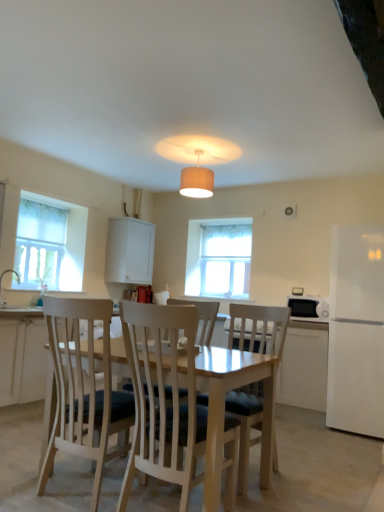
This screenshot has width=384, height=512. Describe the element at coordinates (129, 251) in the screenshot. I see `white matte cabinet at upper center` at that location.

What do you see at coordinates (50, 243) in the screenshot? This screenshot has height=512, width=384. I see `translucent fabric window at left, which appears as the 2th window when viewed from the back` at bounding box center [50, 243].

What do you see at coordinates (219, 258) in the screenshot? The image size is (384, 512). I see `white textured window at center, the 1th window from the back` at bounding box center [219, 258].

Find the location of a particular element. white glossy microwave at lower right is located at coordinates (308, 307).

Between white wood chair at center, which is the second chair from right to left, and light wood chair at center, arranged as the 2th chair when viewed from the left, which one has smaller width?

Thinner between the two is white wood chair at center, which is the second chair from right to left.

How far apart are white wood chair at center, the first chair in the left-to-right sequence, and light wood chair at center, arranged as the 2th chair when viewed from the left?

A distance of 17.47 inches exists between white wood chair at center, the first chair in the left-to-right sequence, and light wood chair at center, arranged as the 2th chair when viewed from the left.

Based on their positions, is white wood chair at center, the first chair in the left-to-right sequence, located to the left or right of light wood chair at center, arranged as the 2th chair when viewed from the left?

white wood chair at center, the first chair in the left-to-right sequence, is to the left of light wood chair at center, arranged as the 2th chair when viewed from the left.

Between white textured window at center, which is the 2th window in left-to-right order, and white glossy microwave at lower right, which one has less height?

white glossy microwave at lower right.

I want to click on window that is the 2nd object above the white glossy microwave at lower right (from a real-world perspective), so click(x=219, y=258).

Considering the points (211, 280) and (317, 297), which point is behind, point (211, 280) or point (317, 297)?

Point (211, 280)

From a real-world perspective, which is physically below, white textured window at center, the 1th window positioned from the right, or white glossy microwave at lower right?

white glossy microwave at lower right.

Would you consider light wood chair at center, arranged as the 2th chair when viewed from the left, to be distant from white glossy sink at left?

Absolutely, light wood chair at center, arranged as the 2th chair when viewed from the left, is distant from white glossy sink at left.

Is light wood chair at center, which is the first chair from right to left, situated inside white glossy sink at left or outside?

light wood chair at center, which is the first chair from right to left, exists outside the volume of white glossy sink at left.

From the image's perspective, is light wood chair at center, which is the first chair from right to left, located beneath white glossy sink at left?

Correct, light wood chair at center, which is the first chair from right to left, appears lower than white glossy sink at left in the image.

Is white glossy microwave at lower right smaller than white matte dishwasher at lower right?

Yes, white glossy microwave at lower right is smaller than white matte dishwasher at lower right.

Considering their positions, is white glossy microwave at lower right located in front of or behind white matte dishwasher at lower right?

white glossy microwave at lower right is behind white matte dishwasher at lower right.

From a real-world perspective, which object rests below the other?

white matte dishwasher at lower right.

Image resolution: width=384 pixels, height=512 pixels. Find the location of `appliance above the white matte dishwasher at lower right (from the image's perspective)`. appliance above the white matte dishwasher at lower right (from the image's perspective) is located at coordinates (308, 307).

From a real-world perspective, between white matte refrigerator at right and translucent fabric window at left, which appears as the 2th window when viewed from the back, who is vertically lower?

white matte refrigerator at right is physically lower.

From the picture: In terms of height, does white matte refrigerator at right look taller or shorter compared to translucent fabric window at left, which appears as the 2th window when viewed from the back?

white matte refrigerator at right is taller than translucent fabric window at left, which appears as the 2th window when viewed from the back.

From the picture: From the image's perspective, which is above, white matte refrigerator at right or translucent fabric window at left, the first window viewed from the left?

translucent fabric window at left, the first window viewed from the left, from the image's perspective.

Considering the sizes of objects white matte refrigerator at right and translucent fabric window at left, which appears as the 2th window when viewed from the back, in the image provided, who is bigger, white matte refrigerator at right or translucent fabric window at left, which appears as the 2th window when viewed from the back,?

white matte refrigerator at right.

Does white glossy microwave at lower right lie behind white matte cabinet at upper center?

No, white glossy microwave at lower right is closer to the camera.

From a real-world perspective, is white glossy microwave at lower right positioned under white matte cabinet at upper center based on gravity?

Yes, from a real-world perspective, white glossy microwave at lower right is under white matte cabinet at upper center.

Does point (299, 306) appear closer or farther from the camera than point (143, 278)?

Point (299, 306) appears to be closer to the viewer than point (143, 278).

Does white glossy microwave at lower right have a larger size compared to white matte cabinet at upper center?

No, white glossy microwave at lower right is not bigger than white matte cabinet at upper center.

Could you tell me if white matte refrigerator at right is turned towards white wood chair at center, which is the second chair from right to left?

No, white matte refrigerator at right is not aimed at white wood chair at center, which is the second chair from right to left.

Can you confirm if white matte refrigerator at right is positioned to the right of white wood chair at center, which is the second chair from right to left?

Yes.

Between white matte refrigerator at right and white wood chair at center, which is the second chair from right to left, which one has less height?

Standing shorter between the two is white wood chair at center, which is the second chair from right to left.

From a real-world perspective, which object rests below the other?

white wood chair at center, which is the second chair from right to left, is physically lower.

Identify the location of chair that appears on the right of white wood chair at center, which is the second chair from right to left. (258, 329).

There is a white glossy microwave at lower right. Where is `the 1st window above it (from the image's perspective)`? the 1st window above it (from the image's perspective) is located at coordinates (219, 258).

When comparing their distances from white glossy microwave at lower right, does white matte dishwasher at lower right or white matte refrigerator at right seem closer?

white matte dishwasher at lower right lies closer to white glossy microwave at lower right than the other object.

Consider the image. Considering their positions, is white glossy microwave at lower right positioned closer to translucent fabric window at left, the first window viewed from the left, than white wood chair at center, which is the second chair from right to left?

white glossy microwave at lower right is closer to translucent fabric window at left, the first window viewed from the left.

Looking at the image, which one is located further to white fabric lampshade at center, translucent fabric window at left, the first window viewed from the left, or white matte dishwasher at lower right?

The object further to white fabric lampshade at center is translucent fabric window at left, the first window viewed from the left.

Estimate the real-world distances between objects in this image. Which object is closer to white textured window at center, the 1th window positioned from the right, white matte cabinet at upper center or white glossy sink at left?

white matte cabinet at upper center is closer to white textured window at center, the 1th window positioned from the right.

From the image, which object appears to be nearer to white matte cabinet at upper center, white glossy sink at left or white glossy microwave at lower right?

white glossy sink at left lies closer to white matte cabinet at upper center than the other object.

Which object lies further to the anchor point white matte refrigerator at right, white matte dishwasher at lower right or white glossy microwave at lower right?

The object further to white matte refrigerator at right is white glossy microwave at lower right.

Looking at the image, which one is located closer to white fabric lampshade at center, white matte refrigerator at right or white glossy microwave at lower right?

Among the two, white glossy microwave at lower right is located nearer to white fabric lampshade at center.

Estimate the real-world distances between objects in this image. Which object is closer to white textured window at center, the 1th window from the back, white glossy sink at left or white matte cabinet at upper center?

The object closer to white textured window at center, the 1th window from the back, is white matte cabinet at upper center.

The image size is (384, 512). I want to click on lamp between light wood chair at center, which is the first chair from right to left, and white matte cabinet at upper center in the front-back direction, so click(197, 180).

Identify the location of lamp between white wood chair at center, which is the second chair from right to left, and white matte cabinet at upper center from front to back. (197, 180).

At what (x,y) coordinates should I click in order to perform the action: click on window positioned between white glossy sink at left and white matte cabinet at upper center from near to far. Please return your answer as a coordinate pair (x, y). The image size is (384, 512). Looking at the image, I should click on (50, 243).

You are a GUI agent. You are given a task and a screenshot of the screen. Output one action in this format:
    pyautogui.click(x=<x>, y=<y>)
    Task: Click on the window located between white glossy sink at left and white matte refrigerator at right in the left-right direction
    Image resolution: width=384 pixels, height=512 pixels.
    Given the screenshot: What is the action you would take?
    pyautogui.click(x=219, y=258)